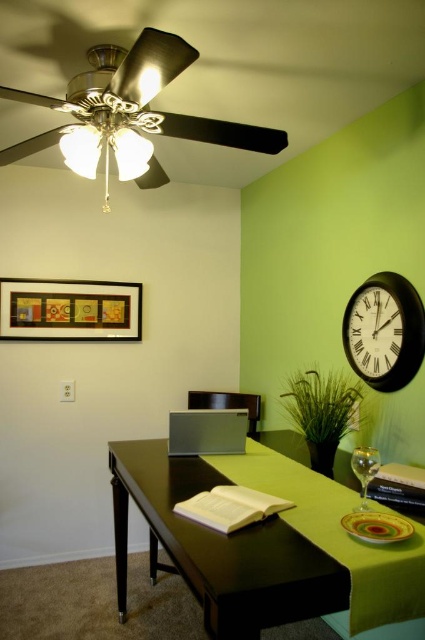
Question: Which object is closer to the camera taking this photo?

Choices:
 (A) metallic gray laptop at center
 (B) matte black picture frame at upper left
 (C) matte black chair at center
 (D) black glossy table at center

Answer: (D)

Question: Does matte black chair at center appear on the right side of transparent glass wine glass at center?

Choices:
 (A) no
 (B) yes

Answer: (A)

Question: Where is black matte clock at upper right located in relation to transparent glass wine glass at center in the image?

Choices:
 (A) left
 (B) right

Answer: (B)

Question: Estimate the real-world distances between objects in this image. Which object is farther from the black matte clock at upper right?

Choices:
 (A) metallic gray laptop at center
 (B) black glossy table at center
 (C) transparent glass wine glass at center

Answer: (B)

Question: Is black glossy table at center bigger than black matte clock at upper right?

Choices:
 (A) no
 (B) yes

Answer: (B)

Question: Which of the following is the closest to the observer?

Choices:
 (A) metallic gray laptop at center
 (B) black matte clock at upper right
 (C) black glossy table at center
 (D) matte black chair at center

Answer: (C)